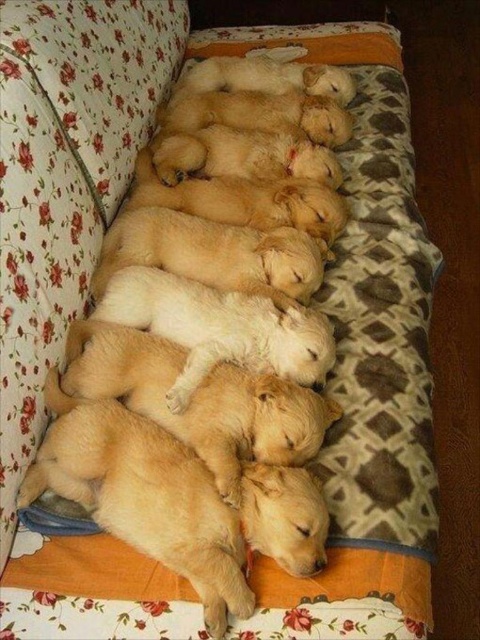
You are a photographer trying to capture the puppies on the soft fleece pillow at center. To ensure the pillow is in the center of your photo, where should you position your camera?

The soft fleece pillow at center is located at point (370, 292), so you should position your camera to focus on that coordinate to center the pillow in your photo.

You are a photographer aiming to capture a closeup of the soft fleece pillow at center without the soft golden fur puppies at center blocking the view. Based on their positions, is this possible?

The soft fleece pillow at center is further to the viewer than the soft golden fur puppies at center, so it is possible to take a closeup of the soft fleece pillow at center without the puppies blocking the view since the pillow is closer to the photographer.